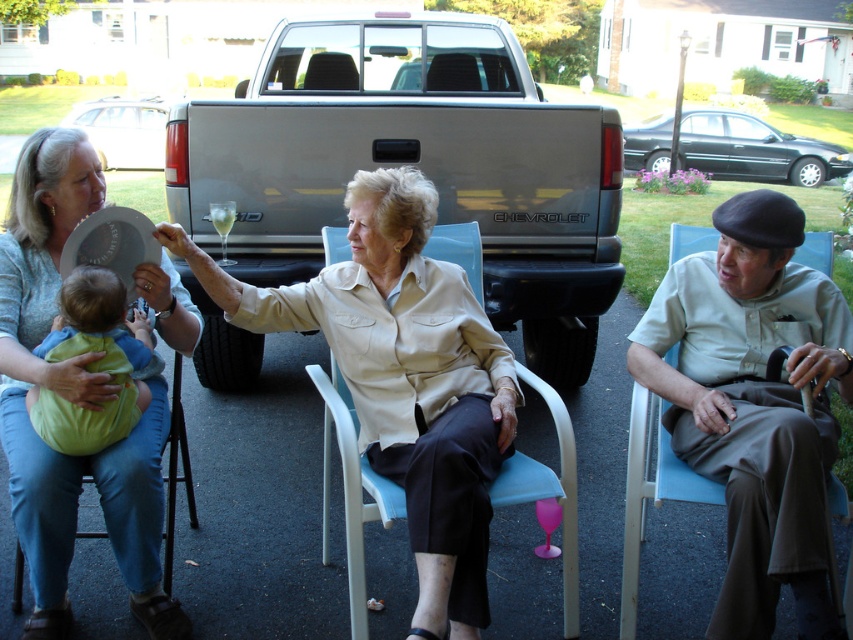
Consider the image. You are at a backyard gathering and see the light beige shirt at center and the beige fabric chair at center. Which one is closer to the ground?

The light beige shirt at center is located below the beige fabric chair at center, so it is closer to the ground.

You are a photographer taking a picture of the light beige shirt at center and the matte beige blouse at center. Which one will appear larger in the photo?

The light beige shirt at center will appear larger in the photo because it is closer to the viewer than the matte beige blouse at center.

You are planning to place a small potted plant at point (403, 378). What object is currently located at that point?

The beige fabric chair at center is located at point (403, 378).